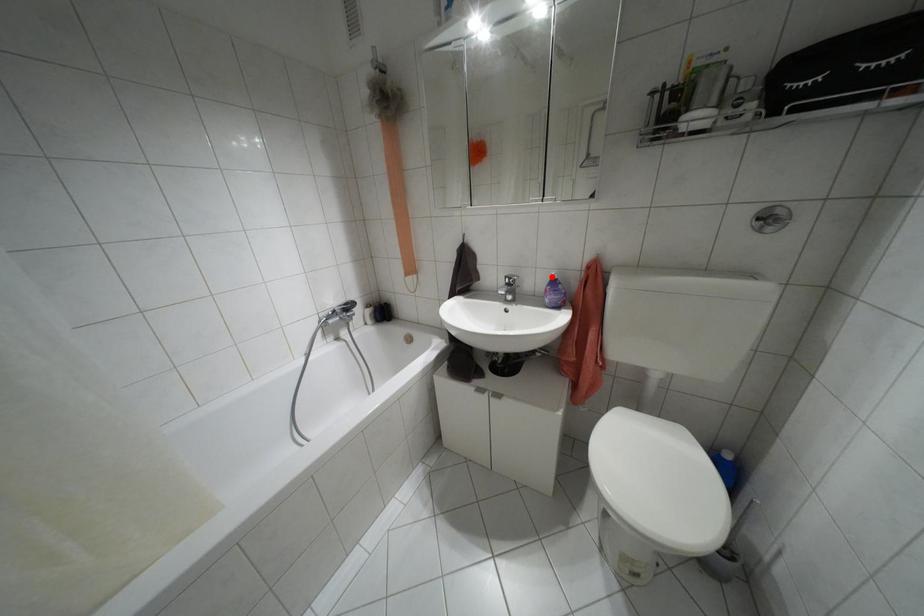
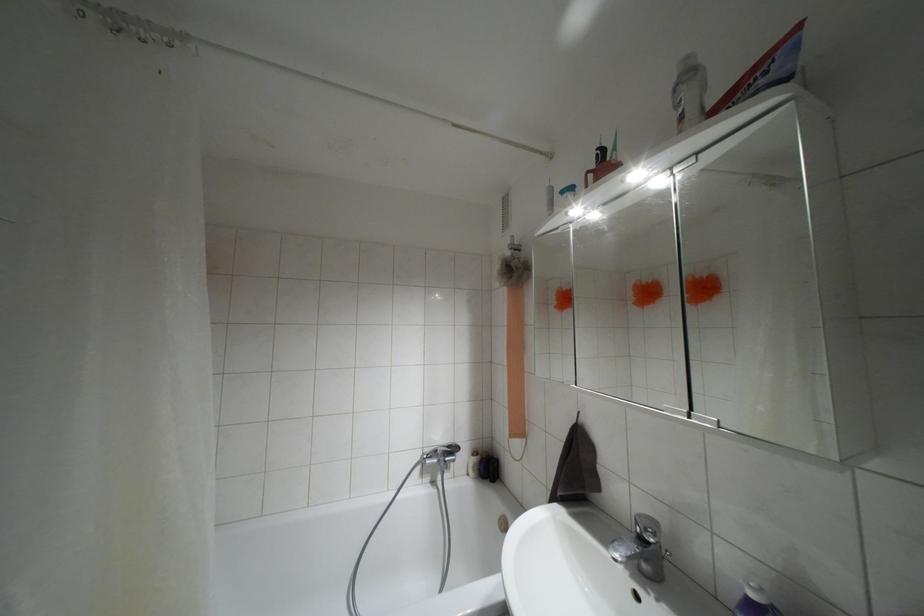
In the second image, find the point that corresponds to the highlighted location in the first image.

(751, 594)